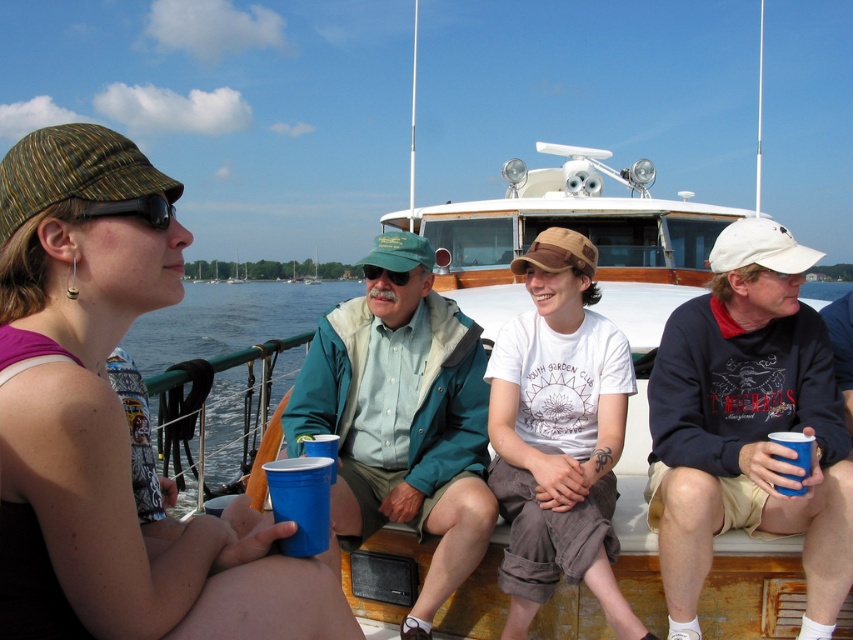
Question: Can you confirm if white cotton t-shirt at center is positioned below black rubber goggles at upper left?

Choices:
 (A) yes
 (B) no

Answer: (A)

Question: Which of the following is the closest to the observer?

Choices:
 (A) blue plastic cup at lower right
 (B) green matte sunglasses at center

Answer: (A)

Question: Observing the image, what is the correct spatial positioning of white cotton cap at upper right in reference to black rubber goggles at upper left?

Choices:
 (A) above
 (B) below

Answer: (B)

Question: Is blue plastic cup at lower right thinner than green matte sunglasses at center?

Choices:
 (A) no
 (B) yes

Answer: (B)

Question: Considering the real-world distances, which object is farthest from the white cotton cap at upper right?

Choices:
 (A) black rubber goggles at upper left
 (B) teal fabric jacket at center
 (C) blue plastic cup at lower left

Answer: (A)

Question: Which object is the farthest from the blue plastic cup at lower left?

Choices:
 (A) blue plastic cup at lower center
 (B) white cotton cap at upper right
 (C) blue plastic cup at lower right

Answer: (A)